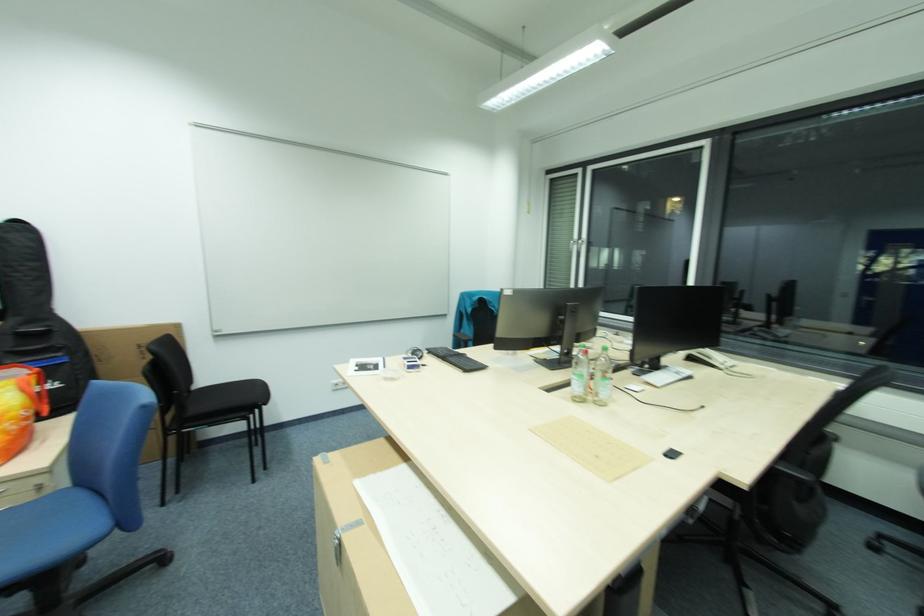
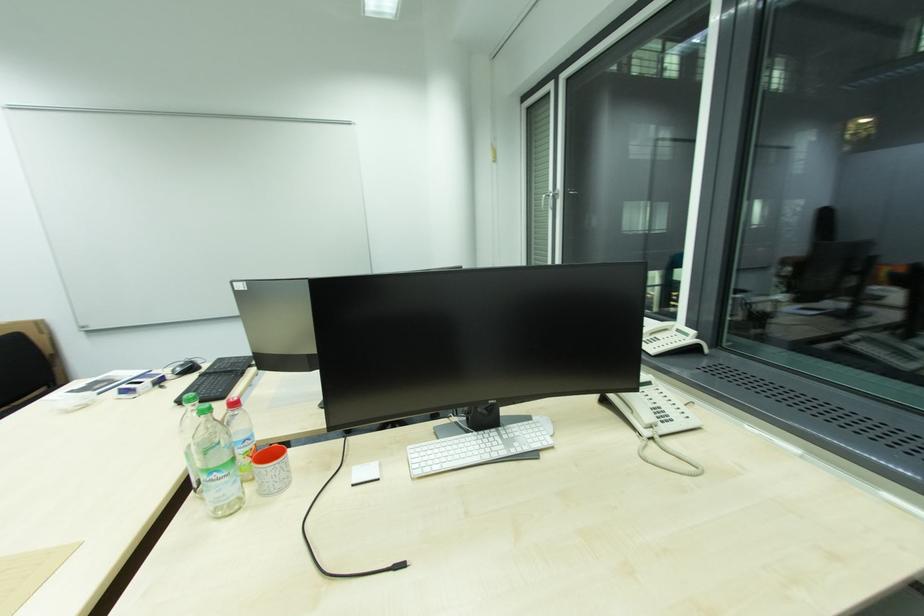
In the scene shown: In a continuous first-person perspective shot, in which direction is the camera moving?

The movement direction of the cameraman is right, forward.